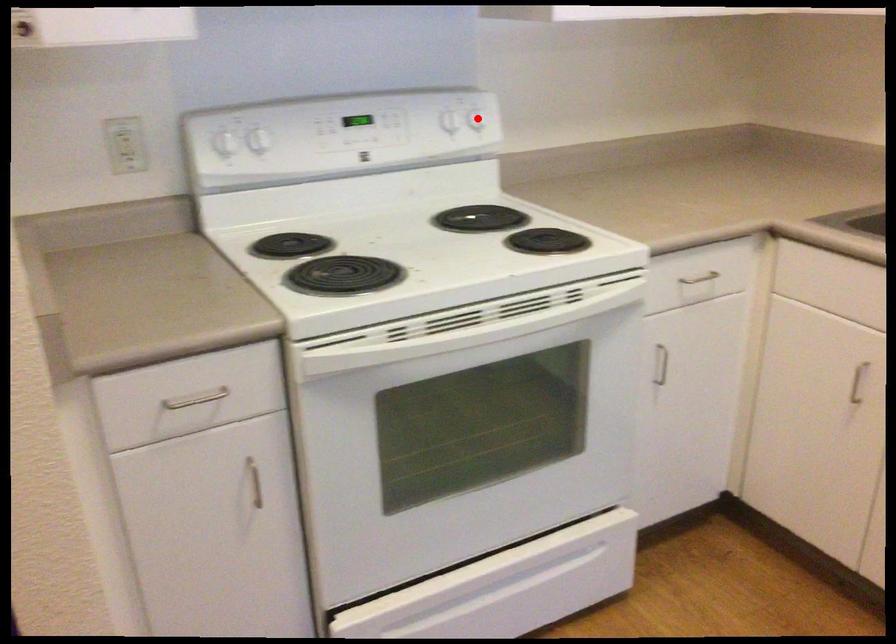
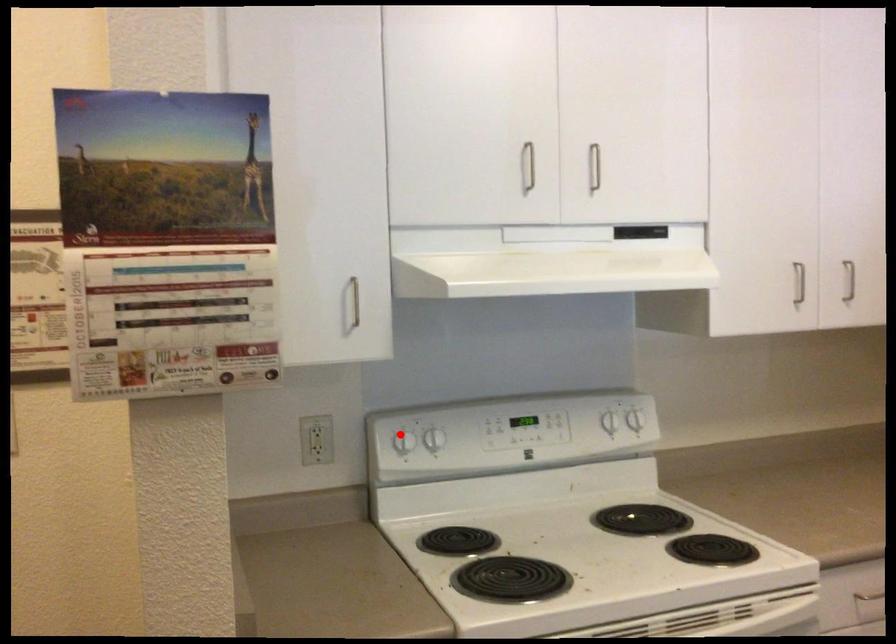
I am providing you with two images of the same scene from different viewpoints. A red point is marked on the first image and another point is marked on the second image. Do the highlighted points in image1 and image2 indicate the same real-world spot?

No